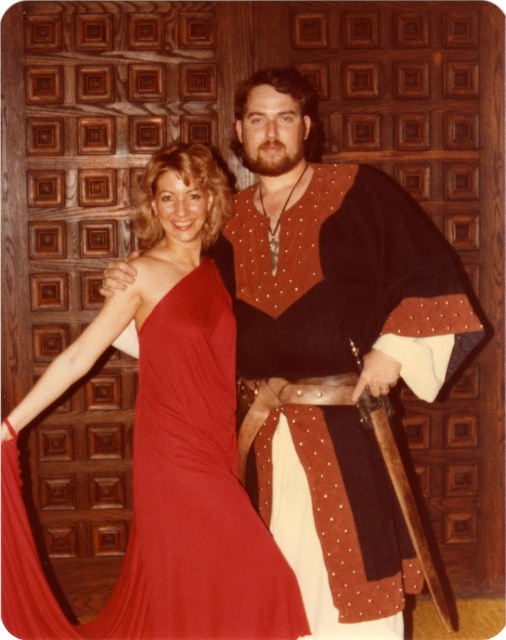
Where is `suede-like vest at center`? suede-like vest at center is located at coordinates (331, 349).

Is suede-like vest at center bigger than shiny satin dress at center?

Yes, suede-like vest at center is bigger than shiny satin dress at center.

Image resolution: width=506 pixels, height=640 pixels. What are the coordinates of `suede-like vest at center` in the screenshot? It's located at (331, 349).